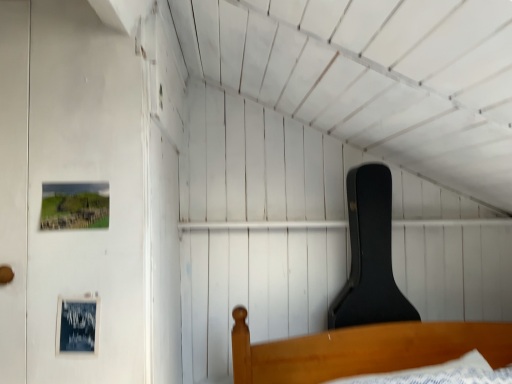
Where is `black matte guitar case at upper right`? This screenshot has height=384, width=512. black matte guitar case at upper right is located at coordinates (370, 255).

The image size is (512, 384). What do you see at coordinates (370, 255) in the screenshot? I see `black matte guitar case at upper right` at bounding box center [370, 255].

Where is `black matte guitar case at upper right`? This screenshot has width=512, height=384. black matte guitar case at upper right is located at coordinates (370, 255).